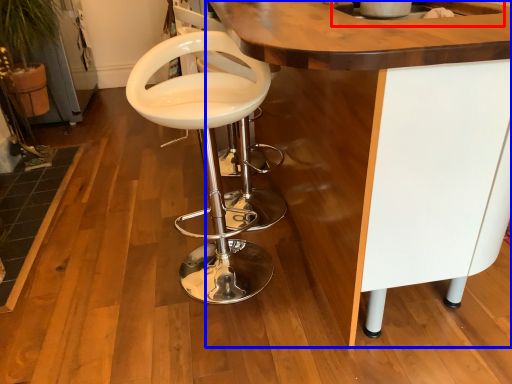
Question: Which object is further to the camera taking this photo, sink (highlighted by a red box) or table (highlighted by a blue box)?

Choices:
 (A) sink
 (B) table

Answer: (A)